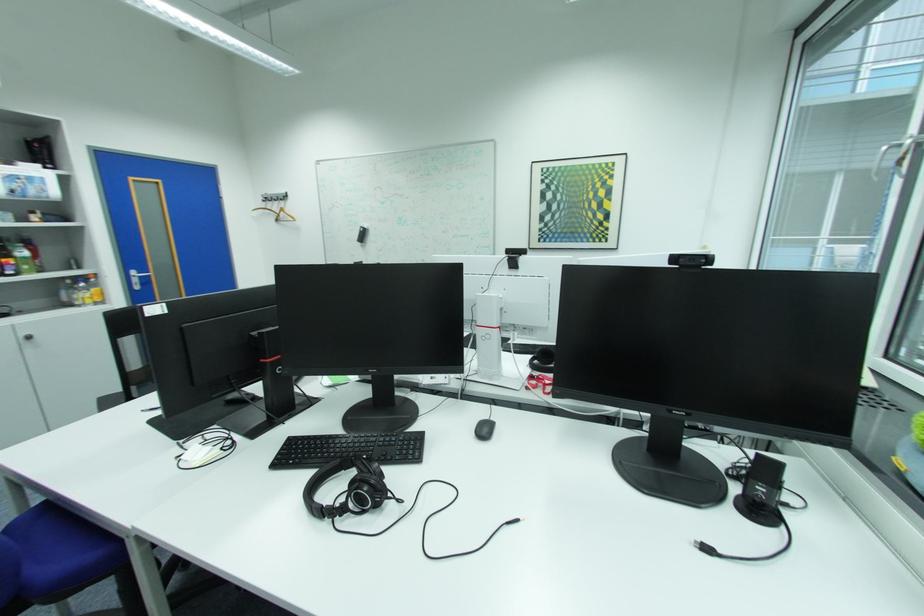
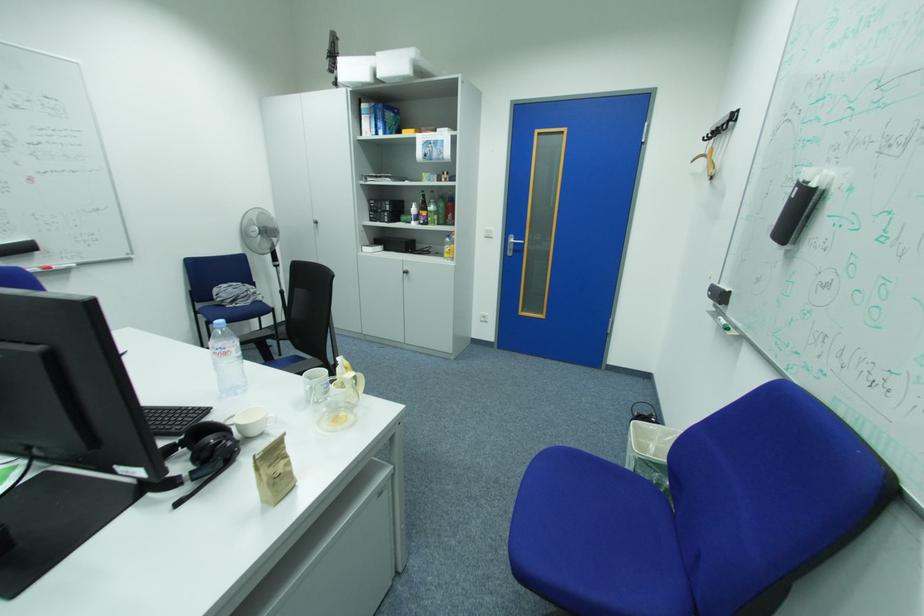
Where in the second image is the point corresponding to point 40,338 from the first image?

(415, 273)